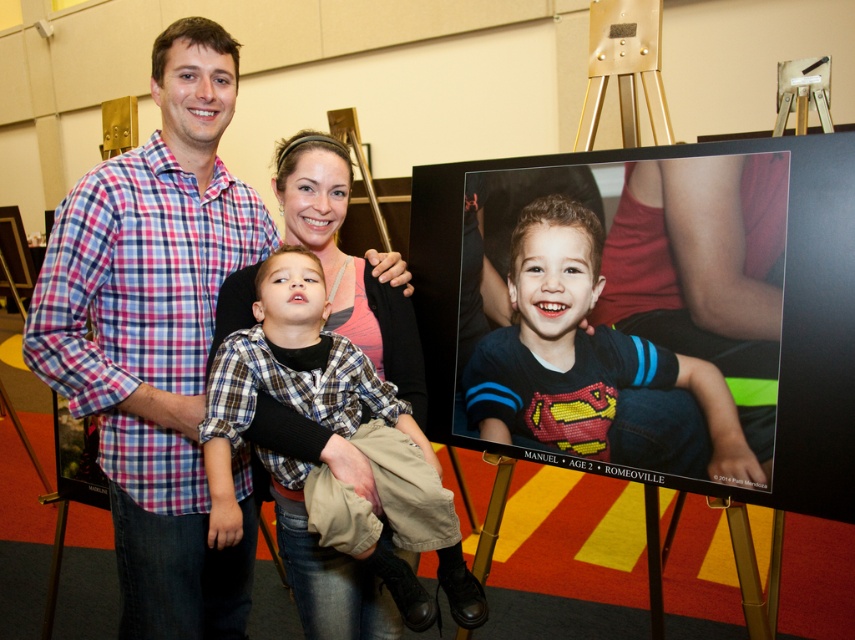
Is plaid cotton shirt at center bigger than plaid fabric shirt at center?

Correct, plaid cotton shirt at center is larger in size than plaid fabric shirt at center.

Is point (184, 230) farther from camera compared to point (438, 544)?

Yes.

Is point (245, 477) farther from camera compared to point (278, 323)?

Yes.

Where is `plaid cotton shirt at center`? The width and height of the screenshot is (855, 640). plaid cotton shirt at center is located at coordinates (155, 333).

Does superman t-shirt at center have a lesser width compared to plaid fabric shirt at center?

Incorrect, superman t-shirt at center's width is not less than plaid fabric shirt at center's.

The image size is (855, 640). Describe the element at coordinates (582, 356) in the screenshot. I see `superman t-shirt at center` at that location.

Measure the distance between point (528,400) and camera.

1.70 meters

In order to click on superman t-shirt at center in this screenshot , I will do `click(582, 356)`.

Which is behind, point (207, 224) or point (506, 410)?

Positioned behind is point (506, 410).

Image resolution: width=855 pixels, height=640 pixels. In order to click on plaid cotton shirt at center in this screenshot , I will do `click(155, 333)`.

Is point (83, 243) farther from viewer compared to point (616, 449)?

That is False.

Locate an element on the screen. plaid cotton shirt at center is located at coordinates (155, 333).